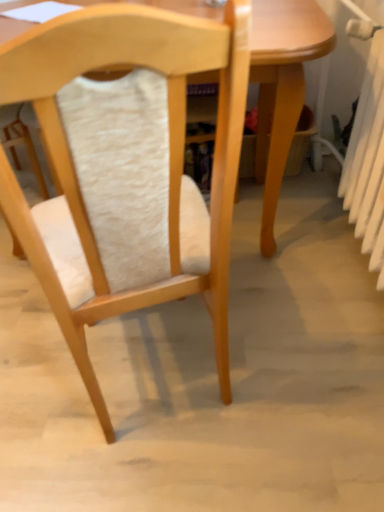
Question: Is white plastic radiator at right to the right of light wood table at center from the viewer's perspective?

Choices:
 (A) yes
 (B) no

Answer: (A)

Question: From the image's perspective, is white plastic radiator at right beneath light wood table at center?

Choices:
 (A) yes
 (B) no

Answer: (A)

Question: From a real-world perspective, is white plastic radiator at right below light wood table at center?

Choices:
 (A) no
 (B) yes

Answer: (A)

Question: Is white plastic radiator at right positioned beyond the bounds of light wood table at center?

Choices:
 (A) no
 (B) yes

Answer: (B)

Question: From the image's perspective, is white plastic radiator at right on light wood table at center?

Choices:
 (A) no
 (B) yes

Answer: (A)

Question: Considering the relative sizes of white plastic radiator at right and light wood table at center in the image provided, is white plastic radiator at right bigger than light wood table at center?

Choices:
 (A) yes
 (B) no

Answer: (B)

Question: Does light wood table at center have a lesser width compared to white plastic radiator at right?

Choices:
 (A) no
 (B) yes

Answer: (A)

Question: From a real-world perspective, is light wood table at center positioned under white plastic radiator at right based on gravity?

Choices:
 (A) yes
 (B) no

Answer: (A)

Question: Is light wood table at center oriented towards white plastic radiator at right?

Choices:
 (A) yes
 (B) no

Answer: (B)

Question: Is light wood table at center turned away from white plastic radiator at right?

Choices:
 (A) no
 (B) yes

Answer: (A)

Question: Is light wood table at center bigger than white plastic radiator at right?

Choices:
 (A) no
 (B) yes

Answer: (B)

Question: From the image's perspective, is light wood table at center located beneath white plastic radiator at right?

Choices:
 (A) yes
 (B) no

Answer: (B)

Question: From a real-world perspective, does wooden chair at center stand above white plastic radiator at right?

Choices:
 (A) no
 (B) yes

Answer: (B)